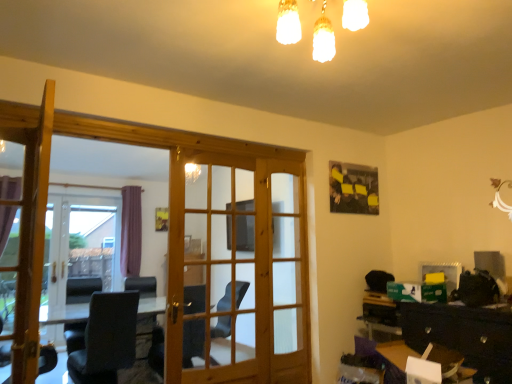
Question: Does matte wooden screen door at center, which appears as the first screen door when viewed from the right, have a greater width compared to wooden table at lower right?

Choices:
 (A) no
 (B) yes

Answer: (A)

Question: Is matte wooden screen door at center, acting as the 2th screen door starting from the left, facing towards wooden table at lower right?

Choices:
 (A) yes
 (B) no

Answer: (A)

Question: From a real-world perspective, is matte wooden screen door at center, which is the first screen door from front to back, over wooden table at lower right?

Choices:
 (A) no
 (B) yes

Answer: (B)

Question: Considering the relative sizes of matte wooden screen door at center, which appears as the first screen door when viewed from the right, and wooden table at lower right in the image provided, is matte wooden screen door at center, which appears as the first screen door when viewed from the right, shorter than wooden table at lower right?

Choices:
 (A) yes
 (B) no

Answer: (B)

Question: Considering the relative sizes of matte wooden screen door at center, which appears as the first screen door when viewed from the right, and wooden table at lower right in the image provided, is matte wooden screen door at center, which appears as the first screen door when viewed from the right, smaller than wooden table at lower right?

Choices:
 (A) no
 (B) yes

Answer: (B)

Question: From the image's perspective, is matte wooden screen door at center, acting as the 2th screen door starting from the left, below wooden table at lower right?

Choices:
 (A) no
 (B) yes

Answer: (A)

Question: Can you confirm if wooden door at center, the second door viewed from the front, is smaller than wooden table at lower right?

Choices:
 (A) yes
 (B) no

Answer: (B)

Question: From the image's perspective, is wooden door at center, the second door viewed from the front, under wooden table at lower right?

Choices:
 (A) no
 (B) yes

Answer: (A)

Question: Is wooden door at center, which ranks as the 1th door in right-to-left order, to the left of wooden table at lower right from the viewer's perspective?

Choices:
 (A) no
 (B) yes

Answer: (B)

Question: From a real-world perspective, is wooden door at center, which is counted as the 1th door, starting from the back, located higher than wooden table at lower right?

Choices:
 (A) no
 (B) yes

Answer: (B)

Question: Would you say wooden door at center, placed as the 2th door when sorted from left to right, contains wooden table at lower right?

Choices:
 (A) no
 (B) yes

Answer: (A)

Question: Is wooden door at center, which ranks as the 1th door in right-to-left order, facing towards wooden table at lower right?

Choices:
 (A) no
 (B) yes

Answer: (A)

Question: Considering the relative sizes of matte wooden screen door at center, positioned as the second screen door in back-to-front order, and clear glass door at left, arranged as the 1th screen door when viewed from the left, in the image provided, is matte wooden screen door at center, positioned as the second screen door in back-to-front order, taller than clear glass door at left, arranged as the 1th screen door when viewed from the left,?

Choices:
 (A) no
 (B) yes

Answer: (A)